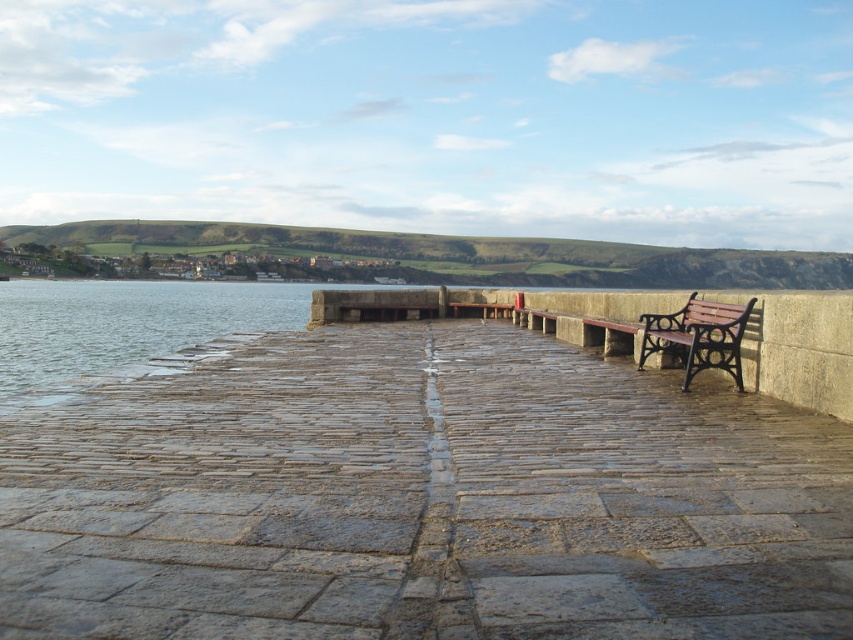
Question: Which point is closer to the camera taking this photo?

Choices:
 (A) (701, 369)
 (B) (492, 586)

Answer: (B)

Question: Is stone textured dock at center thinner than brown wooden bench at right?

Choices:
 (A) yes
 (B) no

Answer: (B)

Question: Considering the relative positions of stone textured dock at center and brown wooden bench at right in the image provided, where is stone textured dock at center located with respect to brown wooden bench at right?

Choices:
 (A) right
 (B) left

Answer: (B)

Question: Can you confirm if stone textured dock at center is positioned to the right of brown wooden bench at right?

Choices:
 (A) no
 (B) yes

Answer: (A)